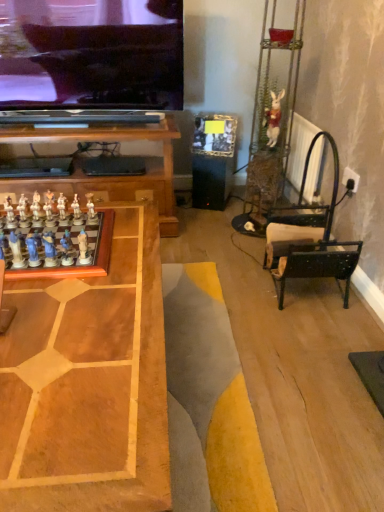
Locate an element on the screen. Image resolution: width=384 pixels, height=512 pixels. space that is in front of matte blue chess piece at left, which is counted as the fourth toy, starting from the right is located at coordinates (56, 293).